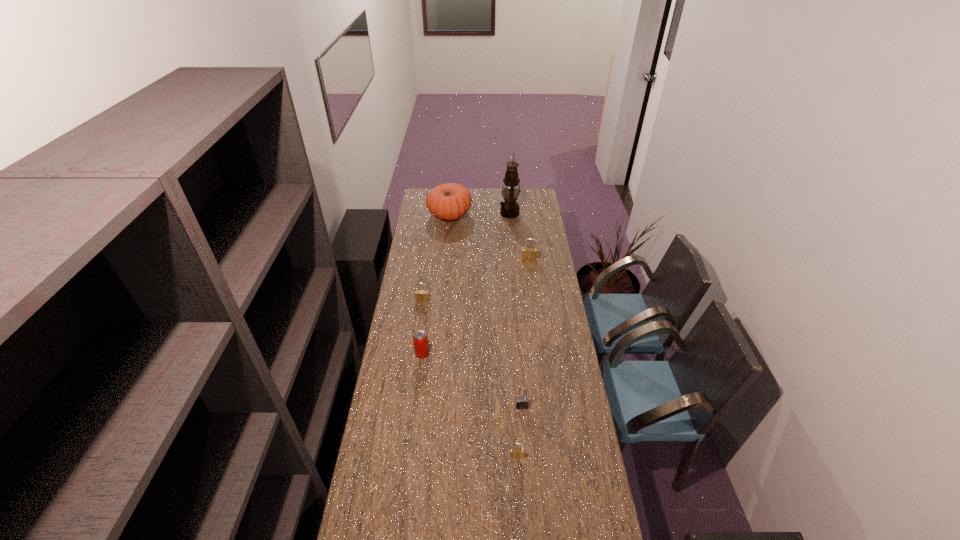
Find the location of a particular element. The height and width of the screenshot is (540, 960). the second smallest brass padlock is located at coordinates (421, 295).

The image size is (960, 540). Find the location of `the leftmost padlock`. the leftmost padlock is located at coordinates (421, 295).

Find the location of a particular element. the nearest brass padlock is located at coordinates (514, 452).

The width and height of the screenshot is (960, 540). Find the location of `the second nearest padlock`. the second nearest padlock is located at coordinates 514,452.

I want to click on vacant space located on the front of the brown oil lamp, so click(511, 227).

Where is `free space located 0.090m on the right of the orange pumpkin`? Image resolution: width=960 pixels, height=540 pixels. free space located 0.090m on the right of the orange pumpkin is located at coordinates (486, 215).

Image resolution: width=960 pixels, height=540 pixels. In order to click on free point located 0.220m on the front-facing side of the farthest brass padlock in this screenshot , I will do `click(533, 288)`.

I want to click on vacant space located on the left of the fifth farthest object, so click(404, 354).

At what (x,y) coordinates should I click in order to perform the action: click on vacant region located 0.140m on the shackle of the bigger gray padlock. Please return your answer as a coordinate pair (x, y). The image size is (960, 540). Looking at the image, I should click on (524, 442).

Locate an element on the screen. Image resolution: width=960 pixels, height=540 pixels. vacant area located on the front-facing side of the leftmost brass padlock is located at coordinates (419, 327).